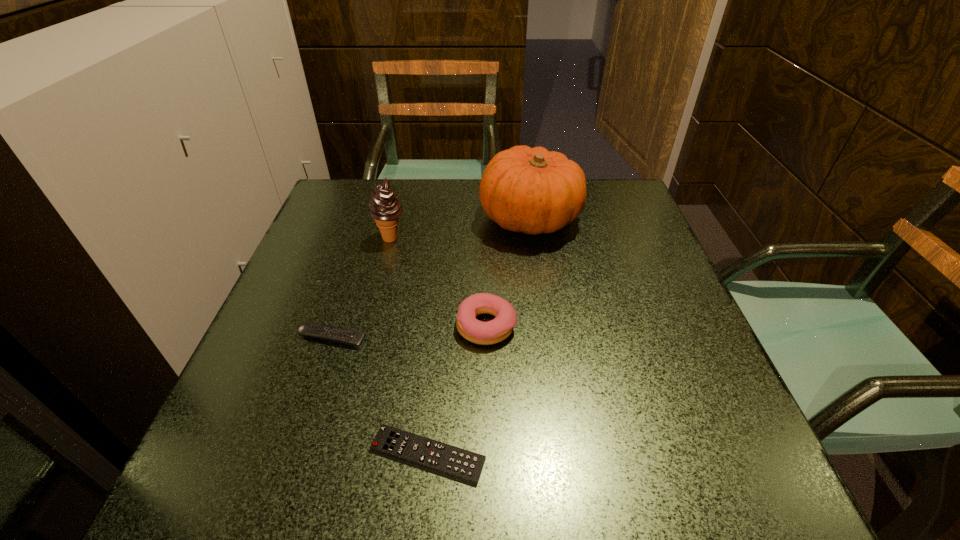
The height and width of the screenshot is (540, 960). I want to click on vacant point located on the front of the farther remote control, so click(308, 413).

At what (x,y) coordinates should I click in order to perform the action: click on free space located 0.080m on the left of the nearest object. Please return your answer as a coordinate pair (x, y). Looking at the image, I should click on (316, 455).

Find the location of a particular element. This screenshot has width=960, height=540. pumpkin positioned at the far edge is located at coordinates [531, 190].

Locate an element on the screen. The height and width of the screenshot is (540, 960). icecream present at the far edge is located at coordinates (385, 207).

The image size is (960, 540). I want to click on object present at the near edge, so click(x=443, y=458).

In order to click on icecream located at the left edge in this screenshot , I will do tap(385, 207).

Where is `remote control at the left edge`? remote control at the left edge is located at coordinates (353, 338).

You are a GUI agent. You are given a task and a screenshot of the screen. Output one action in this format:
    pyautogui.click(x=<x>, y=<y>)
    Task: Click on the object present at the right edge
    
    Given the screenshot: What is the action you would take?
    pyautogui.click(x=531, y=190)

This screenshot has width=960, height=540. I want to click on object that is at the far left corner, so click(x=385, y=207).

The width and height of the screenshot is (960, 540). What are the coordinates of `object that is at the far right corner` in the screenshot? It's located at (531, 190).